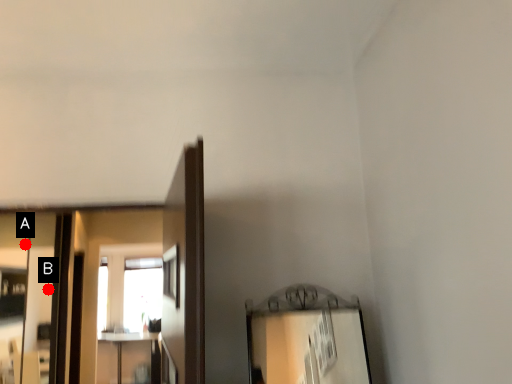
Question: Two points are circled on the image, labeled by A and B beside each circle. Among these points, which one is nearest to the camera?

Choices:
 (A) A is closer
 (B) B is closer

Answer: (B)